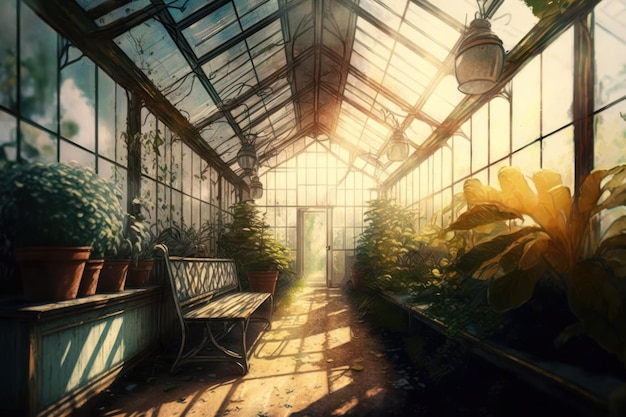
Locate an element on the screen. flower pots is located at coordinates (61, 288), (88, 279), (106, 276), (138, 272), (257, 279).